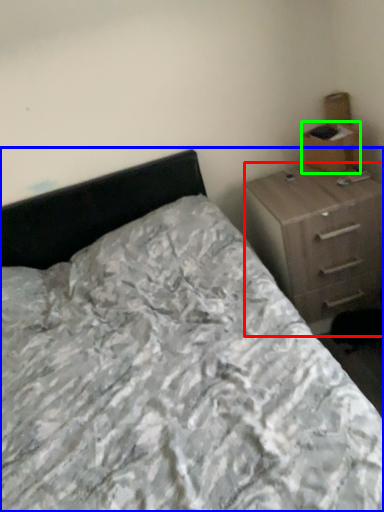
Question: Based on their relative distances, which object is nearer to chest of drawers (highlighted by a red box)? Choose from bed (highlighted by a blue box) and cardboard box (highlighted by a green box).

Choices:
 (A) bed
 (B) cardboard box

Answer: (B)